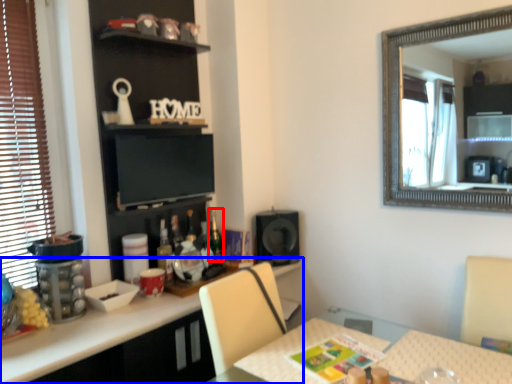
Question: Among these objects, which one is farthest to the camera, bottle (highlighted by a red box) or cabinetry (highlighted by a blue box)?

Choices:
 (A) bottle
 (B) cabinetry

Answer: (A)